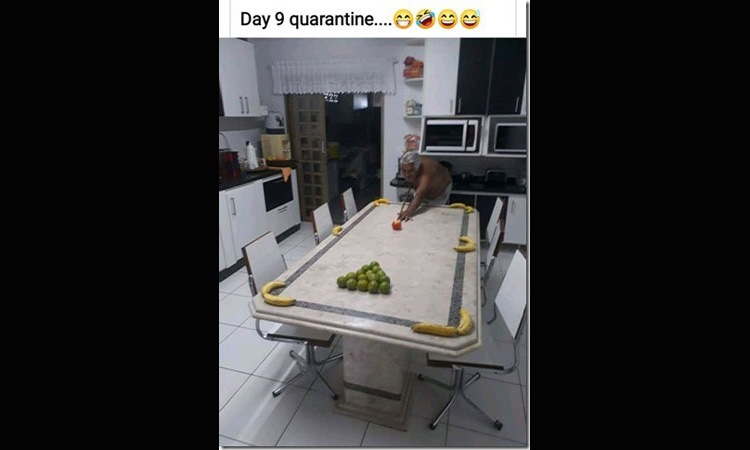
This screenshot has height=450, width=750. In order to click on kitchen floor in this screenshot , I will do `click(312, 428)`.